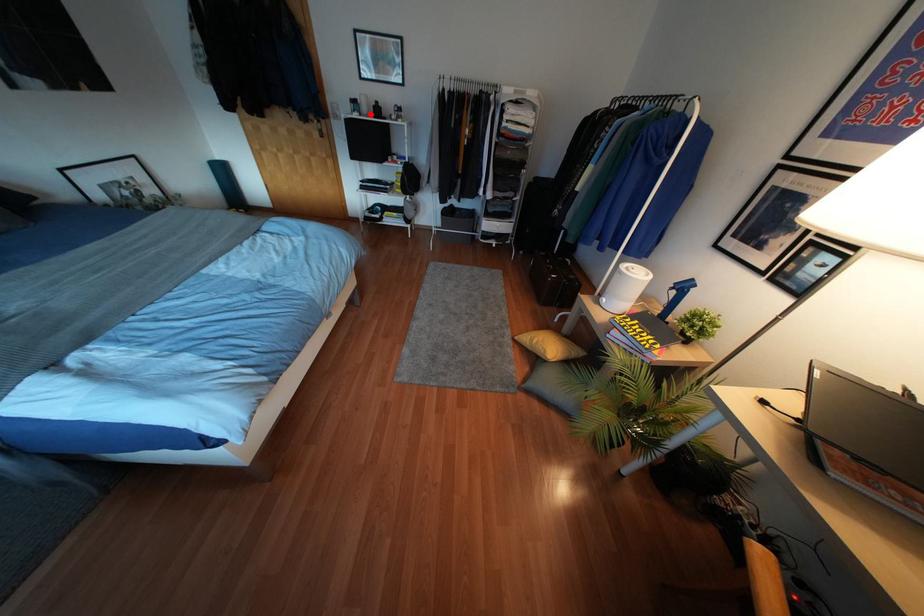
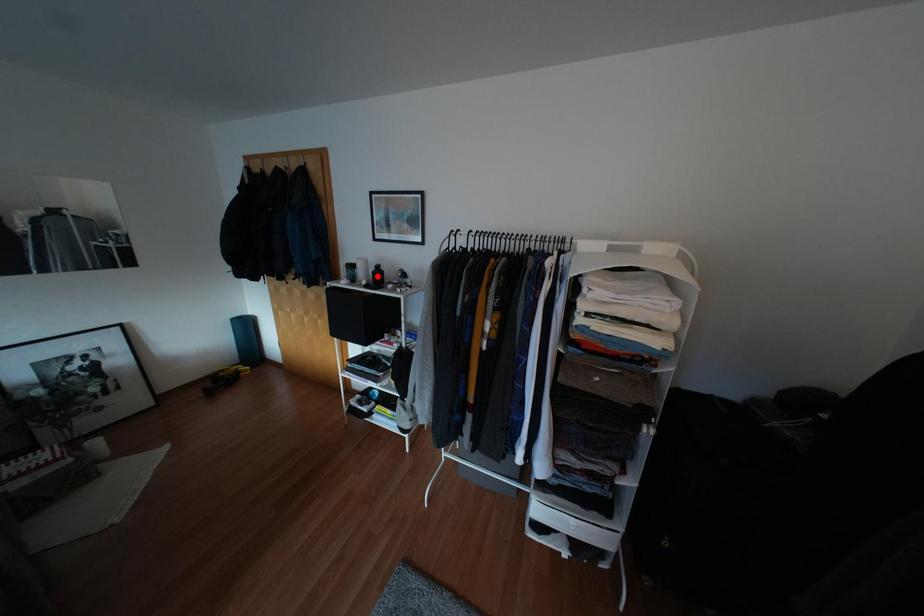
I am providing you with two images of the same scene from different viewpoints. A red point is marked on the first image and another point is marked on the second image. Does the point marked in image1 correspond to the same location as the one in image2?

No